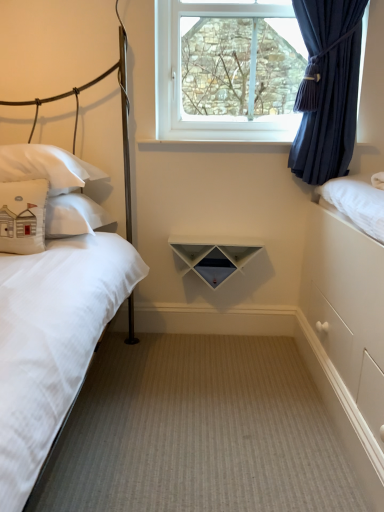
Question: From a real-world perspective, is beige fabric pillow at left, the second pillow positioned from the back, physically located above or below clear glass window at upper center?

Choices:
 (A) above
 (B) below

Answer: (B)

Question: Looking at the image, does beige fabric pillow at left, the second pillow positioned from the back, seem bigger or smaller compared to clear glass window at upper center?

Choices:
 (A) small
 (B) big

Answer: (A)

Question: Considering the real-world distances, which object is closest to the white cotton pillow at left, arranged as the 2th pillow when viewed from the front?

Choices:
 (A) white matte triangle at center
 (B) white matte bed at left
 (C) navy blue sheer curtain at upper right
 (D) beige fabric pillow at left, the second pillow positioned from the back
 (E) beige carpet at center

Answer: (D)

Question: Which of these objects is positioned farthest from the navy blue sheer curtain at upper right?

Choices:
 (A) white matte bed at left
 (B) clear glass window at upper center
 (C) beige carpet at center
 (D) white matte triangle at center
 (E) beige fabric pillow at left, the second pillow positioned from the back

Answer: (E)